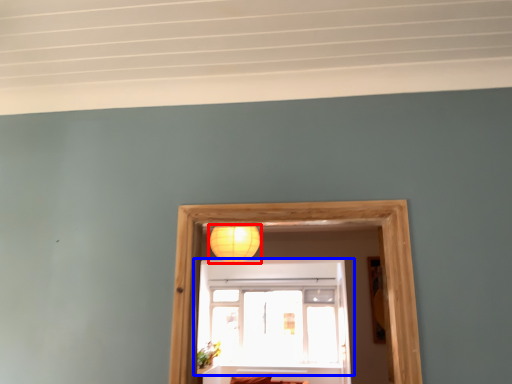
Question: Among these objects, which one is farthest to the camera, lamp (highlighted by a red box) or window (highlighted by a blue box)?

Choices:
 (A) lamp
 (B) window

Answer: (B)